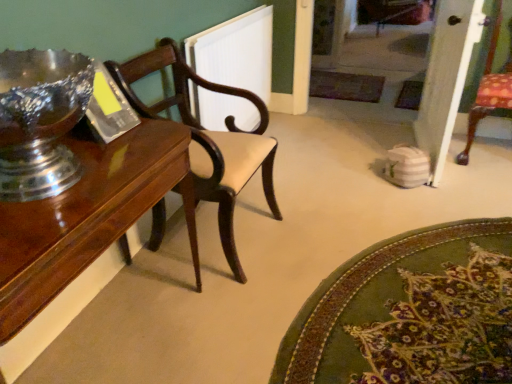
The image size is (512, 384). What are the coordinates of `shiny wood table at left` in the screenshot? It's located at (89, 216).

The image size is (512, 384). What do you see at coordinates (89, 216) in the screenshot?
I see `shiny wood table at left` at bounding box center [89, 216].

What do you see at coordinates (208, 139) in the screenshot? The height and width of the screenshot is (384, 512). I see `mahogany wood chair at left` at bounding box center [208, 139].

Locate an element on the screen. white textured radiator at upper center is located at coordinates (236, 52).

Is point (252, 77) closer or farther from the camera than point (475, 319)?

Point (252, 77).

Can you tell me how much white textured radiator at upper center and green textured rug at lower right differ in facing direction?

There is a 87.7-degree angle between the facing directions of white textured radiator at upper center and green textured rug at lower right.

Can you confirm if white textured radiator at upper center is smaller than green textured rug at lower right?

Incorrect, white textured radiator at upper center is not smaller in size than green textured rug at lower right.

Which object is more forward, white textured radiator at upper center or green textured rug at lower right?

green textured rug at lower right.

Considering the relative sizes of mahogany wood chair at left and green textured rug at lower right in the image provided, is mahogany wood chair at left wider than green textured rug at lower right?

No.

Which is correct: mahogany wood chair at left is inside green textured rug at lower right, or outside of it?

mahogany wood chair at left cannot be found inside green textured rug at lower right.

Looking at the image, does mahogany wood chair at left seem bigger or smaller compared to green textured rug at lower right?

In the image, mahogany wood chair at left appears to be larger than green textured rug at lower right.

From a real-world perspective, is mahogany wood chair at left physically located above or below green textured rug at lower right?

From a real-world perspective, mahogany wood chair at left is physically above green textured rug at lower right.

From the picture: Is mahogany wood chair at left placed right next to shiny wood table at left?

mahogany wood chair at left and shiny wood table at left are clearly separated.

Which of these two, mahogany wood chair at left or shiny wood table at left, is thinner?

shiny wood table at left.

Where is `table to the left of mahogany wood chair at left`? This screenshot has height=384, width=512. table to the left of mahogany wood chair at left is located at coordinates (89, 216).

Which object is closer to the camera, mahogany wood chair at left or shiny wood table at left?

Positioned in front is shiny wood table at left.

Would you say green textured rug at lower right is inside or outside white textured radiator at upper center?

green textured rug at lower right lies outside white textured radiator at upper center.

Does green textured rug at lower right lie in front of white textured radiator at upper center?

Yes, green textured rug at lower right is closer to the camera.

From a real-world perspective, is green textured rug at lower right above or below white textured radiator at upper center?

From a real-world perspective, green textured rug at lower right is physically below white textured radiator at upper center.

Image resolution: width=512 pixels, height=384 pixels. I want to click on mat lying on the right of white textured radiator at upper center, so click(x=410, y=312).

Which point is more forward, (x=443, y=371) or (x=135, y=132)?

Point (x=135, y=132)

From a real-world perspective, which object stands above the other?

shiny wood table at left, from a real-world perspective.

Would you consider green textured rug at lower right to be distant from shiny wood table at left?

green textured rug at lower right is actually quite close to shiny wood table at left.

Based on the photo, can we say green textured rug at lower right lies outside shiny wood table at left?

Yes, green textured rug at lower right is not within shiny wood table at left.

Is white textured radiator at upper center far from mahogany wood chair at left?

No.

From the image's perspective, which is above, white textured radiator at upper center or mahogany wood chair at left?

white textured radiator at upper center, from the image's perspective.

Considering the positions of objects white textured radiator at upper center and mahogany wood chair at left in the image provided, who is more to the right, white textured radiator at upper center or mahogany wood chair at left?

From the viewer's perspective, white textured radiator at upper center appears more on the right side.

Considering the relative positions of shiny wood table at left and mahogany wood chair at left in the image provided, is shiny wood table at left to the left or to the right of mahogany wood chair at left?

shiny wood table at left is to the left of mahogany wood chair at left.

Considering the sizes of shiny wood table at left and mahogany wood chair at left in the image, is shiny wood table at left taller or shorter than mahogany wood chair at left?

Clearly, shiny wood table at left is shorter compared to mahogany wood chair at left.

Is shiny wood table at left facing towards mahogany wood chair at left?

No, shiny wood table at left is not facing towards mahogany wood chair at left.

From a real-world perspective, which object stands above the other?

mahogany wood chair at left, from a real-world perspective.

I want to click on radiator above the green textured rug at lower right (from a real-world perspective), so click(x=236, y=52).

At what (x,y) coordinates should I click in order to perform the action: click on chair on the left of green textured rug at lower right. Please return your answer as a coordinate pair (x, y). Looking at the image, I should click on (208, 139).

Looking at the image, which one is located further to mahogany wood chair at left, white textured radiator at upper center or green textured rug at lower right?

→ green textured rug at lower right is further to mahogany wood chair at left.

Based on their spatial positions, is shiny wood table at left or mahogany wood chair at left further from white textured radiator at upper center?

shiny wood table at left is positioned further to the anchor white textured radiator at upper center.

From the image, which object appears to be farther from mahogany wood chair at left, shiny wood table at left or green textured rug at lower right?

green textured rug at lower right is positioned further to the anchor mahogany wood chair at left.

Based on their spatial positions, is shiny wood table at left or white textured radiator at upper center further from green textured rug at lower right?

Based on the image, white textured radiator at upper center appears to be further to green textured rug at lower right.

Estimate the real-world distances between objects in this image. Which object is further from green textured rug at lower right, mahogany wood chair at left or shiny wood table at left?

shiny wood table at left.

Consider the image. Estimate the real-world distances between objects in this image. Which object is further from green textured rug at lower right, white textured radiator at upper center or mahogany wood chair at left?

The object further to green textured rug at lower right is white textured radiator at upper center.

Considering their positions, is white textured radiator at upper center positioned closer to mahogany wood chair at left than shiny wood table at left?

Among the two, shiny wood table at left is located nearer to mahogany wood chair at left.

When comparing their distances from shiny wood table at left, does white textured radiator at upper center or mahogany wood chair at left seem further?

white textured radiator at upper center lies further to shiny wood table at left than the other object.

Where is `chair located between shiny wood table at left and white textured radiator at upper center in the depth direction`? This screenshot has height=384, width=512. chair located between shiny wood table at left and white textured radiator at upper center in the depth direction is located at coordinates (208, 139).

Where is `mat between shiny wood table at left and white textured radiator at upper center from front to back`? This screenshot has height=384, width=512. mat between shiny wood table at left and white textured radiator at upper center from front to back is located at coordinates (410, 312).

Locate an element on the screen. The height and width of the screenshot is (384, 512). chair located between shiny wood table at left and green textured rug at lower right in the left-right direction is located at coordinates (208, 139).

This screenshot has width=512, height=384. I want to click on chair that lies between white textured radiator at upper center and green textured rug at lower right from top to bottom, so (x=208, y=139).